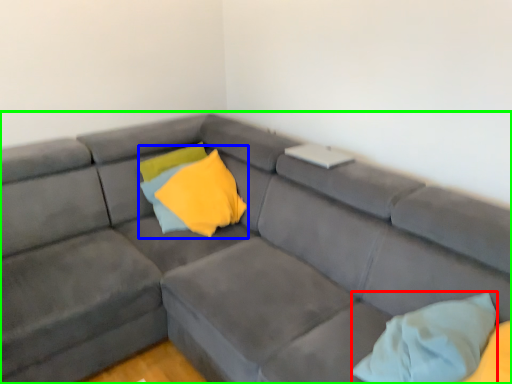
Question: Based on their relative distances, which object is nearer to pillow (highlighted by a red box)? Choose from pillow (highlighted by a blue box) and studio couch (highlighted by a green box).

Choices:
 (A) pillow
 (B) studio couch

Answer: (B)